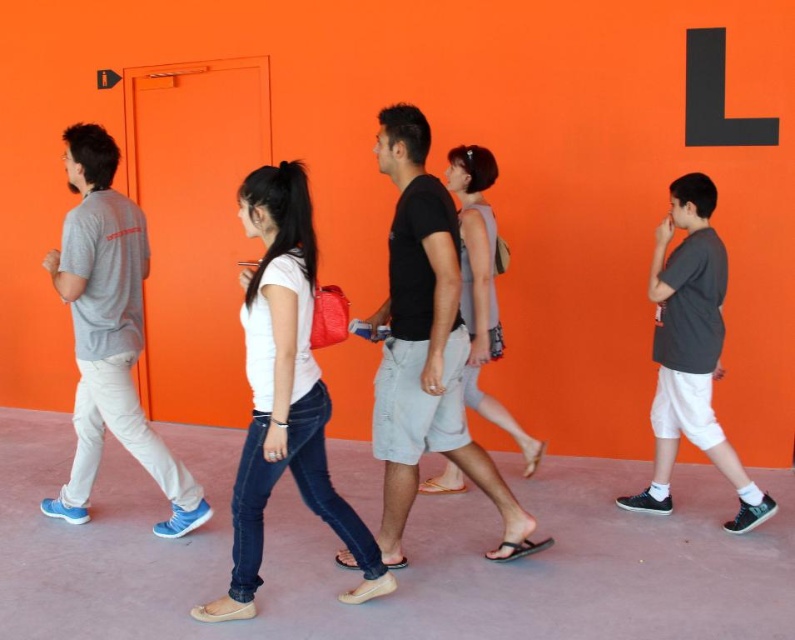
Please describe the position of the black cotton shirt at center relative to the other people in the scene.

The black cotton shirt at center is located at the center of the scene, which is the third person in the line of five individuals walking.